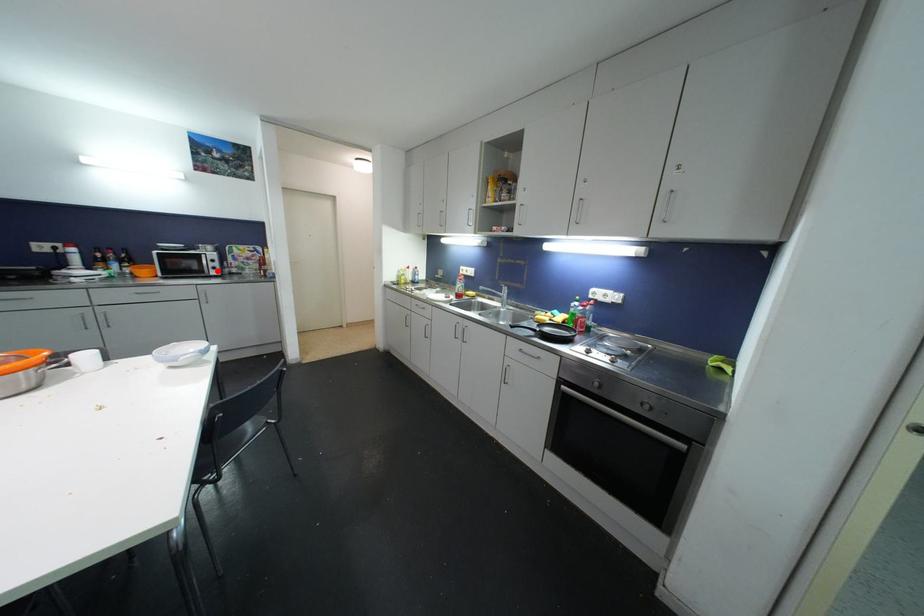
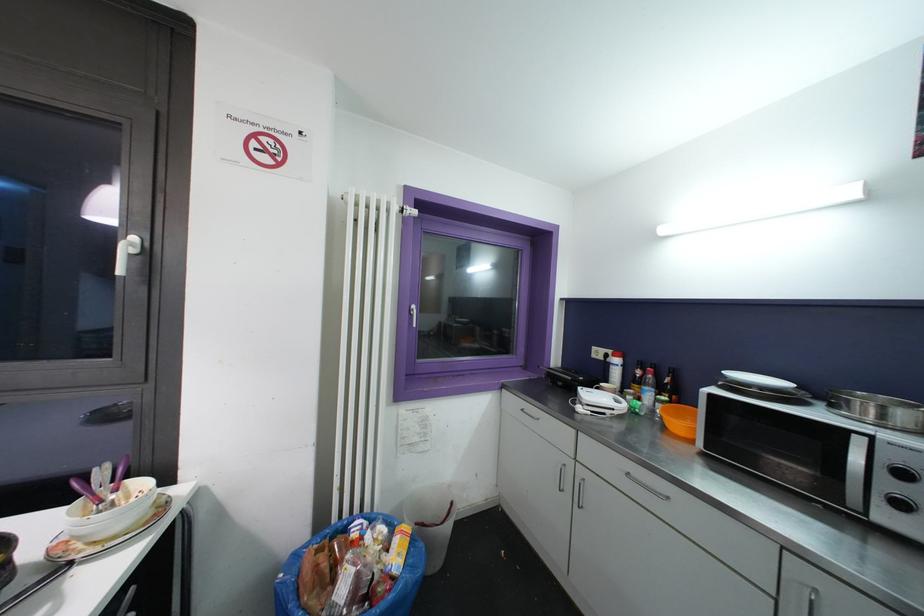
Locate, in the second image, the point that corresponds to the highlighted location in the first image.

(904, 508)